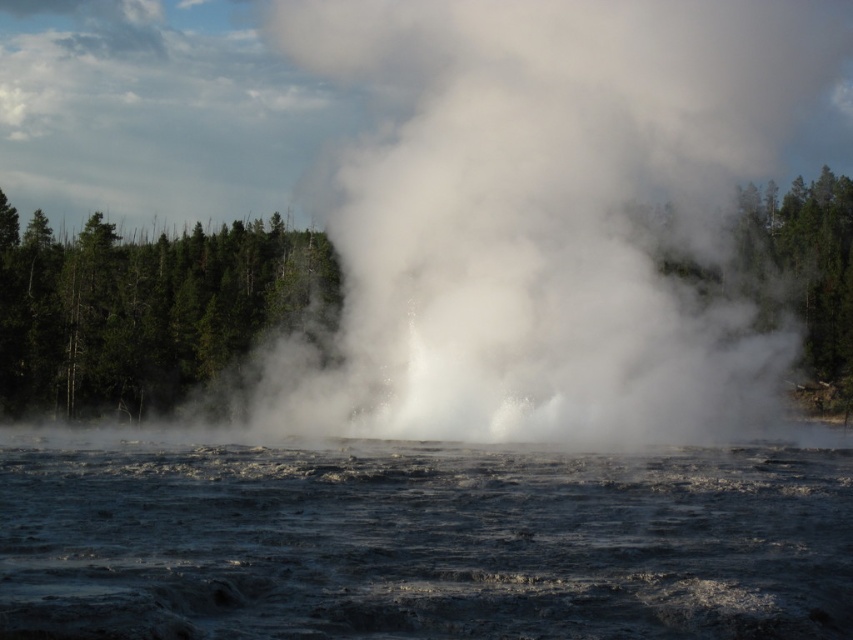
You are a photographer trying to capture the geyser eruption. You notice the white vapor at center and the translucent dark water at center. Which one appears bigger in the photo?

The white vapor at center is larger in size than the translucent dark water at center, so it appears bigger in the photo.

You are standing at the origin point of the coordinate system in the image. You want to locate the translucent dark water at center. In which direction should you move to reach it?

The translucent dark water at center is located at coordinate point 0.848 on the x axis and 0.496 on the y axis. Since you are at the origin, you should move to the right along the x axis and slightly upwards along the y axis to reach it.

You are a photographer aiming to capture the geyser eruption. You want to ensure that both the white vapor at center and the translucent dark water at center are clearly visible in your shot. Based on their positions, which object should you focus on to ensure both are in focus?

The translucent dark water at center is behind white vapor at center. To ensure both are in focus, you should focus on the white vapor at center since it is closer to the camera, and the translucent dark water at center will also be in focus due to its position behind.